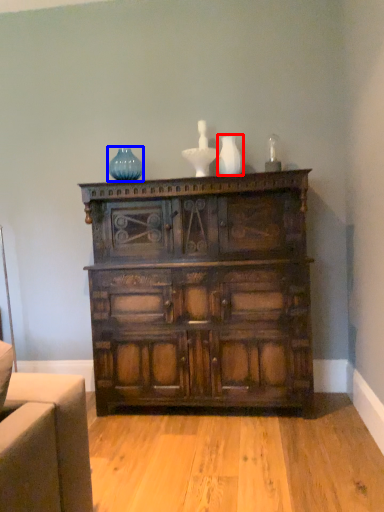
Question: Which of the following is the farthest to the observer, vase (highlighted by a red box) or glass vase (highlighted by a blue box)?

Choices:
 (A) vase
 (B) glass vase

Answer: (B)